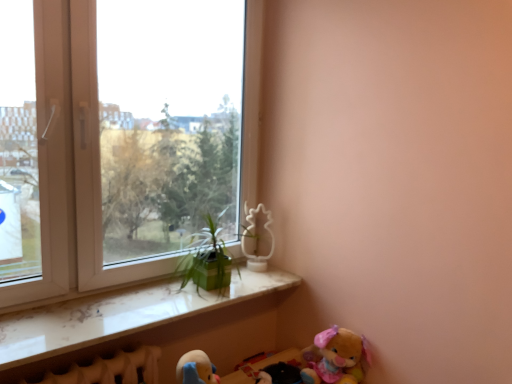
Identify the location of vacant area situated below green matte plant at center (from a real-world perspective). (220, 289).